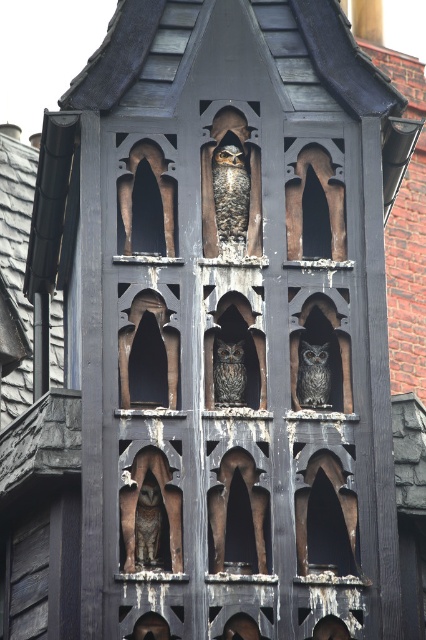
Between point (152, 147) and point (310, 400), which one is positioned behind?

The point (152, 147) is more distant.

Image resolution: width=426 pixels, height=640 pixels. What do you see at coordinates (158, 189) in the screenshot? I see `transparent glass window at upper left` at bounding box center [158, 189].

Between point (166, 208) and point (310, 342), which one is positioned in front?

Positioned in front is point (166, 208).

This screenshot has height=640, width=426. I want to click on transparent glass window at upper left, so click(158, 189).

Who is shorter, brown textured owl at lower left or dark gray textured owl at center?

dark gray textured owl at center is shorter.

Can you confirm if brown textured owl at lower left is positioned below dark gray textured owl at center?

Yes.

Locate an element on the screen. Image resolution: width=426 pixels, height=640 pixels. brown textured owl at lower left is located at coordinates (147, 525).

Who is lower down, speckled brown owl at center or gray textured owl at center?

gray textured owl at center

Image resolution: width=426 pixels, height=640 pixels. What do you see at coordinates (230, 193) in the screenshot? I see `speckled brown owl at center` at bounding box center [230, 193].

Which is in front, point (213, 164) or point (319, 387)?

Point (319, 387) is more forward.

Where is `speckled brown owl at center`? The image size is (426, 640). speckled brown owl at center is located at coordinates (230, 193).